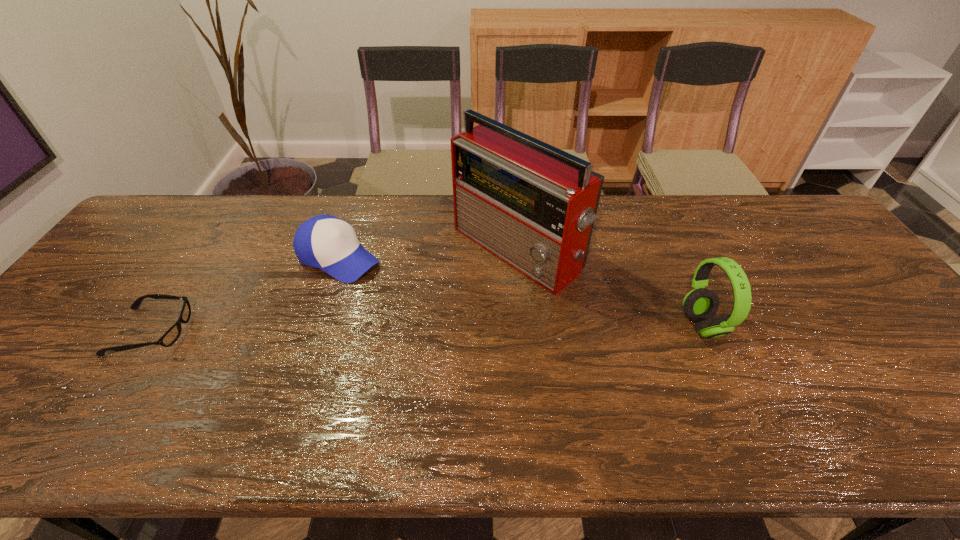
In the image, there is a desktop. Identify the location of blank space at the right edge. Image resolution: width=960 pixels, height=540 pixels. coord(872,287).

Identify the location of free space at the far left corner. This screenshot has height=540, width=960. (146, 219).

This screenshot has height=540, width=960. I want to click on vacant space at the far right corner, so click(x=805, y=231).

Locate an element on the screen. The height and width of the screenshot is (540, 960). free space at the near right corner of the desktop is located at coordinates (946, 388).

Locate an element on the screen. This screenshot has height=540, width=960. free space that is in between the second shortest object and the headset is located at coordinates pyautogui.click(x=520, y=292).

Find the location of `vacant area that lies between the baseball cap and the second object from right to left`. vacant area that lies between the baseball cap and the second object from right to left is located at coordinates (428, 253).

Find the location of a particular element. empty location between the baseball cap and the headset is located at coordinates (520, 292).

This screenshot has height=540, width=960. I want to click on free space between the shortest object and the third tallest object, so click(x=245, y=294).

Locate an element on the screen. vacant space that is in between the spectacles and the second shortest object is located at coordinates (245, 294).

What are the coordinates of `free spot between the headset and the shortest object` in the screenshot? It's located at (427, 328).